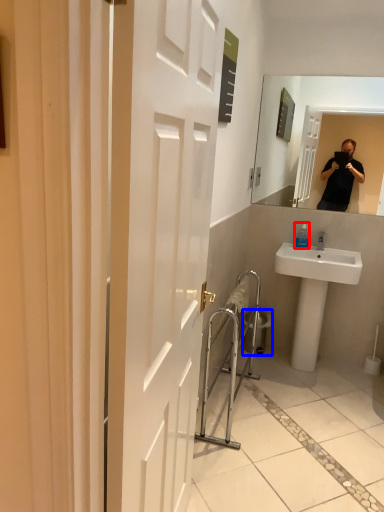
Question: Which point is further to the camera, bottle (highlighted by a red box) or trash bin/can (highlighted by a blue box)?

Choices:
 (A) bottle
 (B) trash bin/can

Answer: (B)